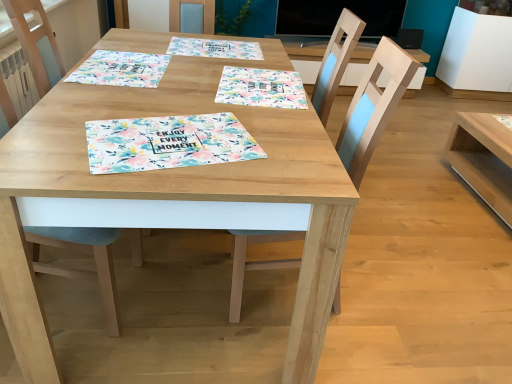
Where is `free location in front of floral paper placemat at upper center, marked as the second tablecloth in a right-to-left arrangement`? The width and height of the screenshot is (512, 384). free location in front of floral paper placemat at upper center, marked as the second tablecloth in a right-to-left arrangement is located at coordinates (207, 66).